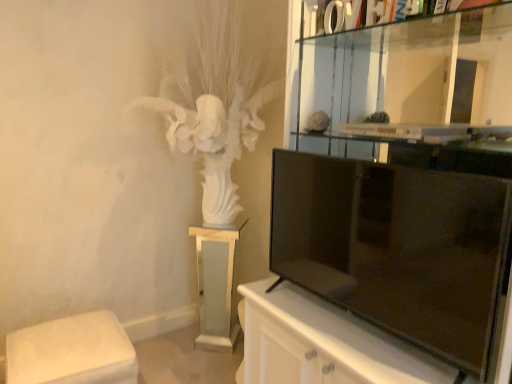
Locate an element on the screen. white fabric ottoman at lower left, which is the first furniture in left-to-right order is located at coordinates tap(72, 352).

The image size is (512, 384). What do you see at coordinates (217, 286) in the screenshot? I see `white frosted glass pedestal at center, which is counted as the 2th furniture, starting from the front` at bounding box center [217, 286].

Identify the location of white fabric ottoman at lower left, arranged as the second furniture when viewed from the back. (72, 352).

Is there a large distance between white fabric ottoman at lower left, arranged as the second furniture when viewed from the back, and white frosted glass pedestal at center, which is the 1th furniture from back to front?

No, there isn't a large distance between white fabric ottoman at lower left, arranged as the second furniture when viewed from the back, and white frosted glass pedestal at center, which is the 1th furniture from back to front.

From a real-world perspective, between white fabric ottoman at lower left, the 1th furniture positioned from the front, and white frosted glass pedestal at center, the 1th furniture positioned from the right, who is vertically lower?

From a 3D spatial view, white fabric ottoman at lower left, the 1th furniture positioned from the front, is below.

Which of these two, white fabric ottoman at lower left, the 2th furniture when ordered from right to left, or white frosted glass pedestal at center, the 1th furniture positioned from the right, stands taller?

white frosted glass pedestal at center, the 1th furniture positioned from the right.

Does white frosted glass pedestal at center, which is counted as the 2th furniture, starting from the front, have a greater height compared to white fabric ottoman at lower left, the 2th furniture when ordered from right to left?

Correct, white frosted glass pedestal at center, which is counted as the 2th furniture, starting from the front, is much taller as white fabric ottoman at lower left, the 2th furniture when ordered from right to left.

Does white frosted glass pedestal at center, which is the 1th furniture from back to front, have a smaller size compared to white fabric ottoman at lower left, arranged as the second furniture when viewed from the back?

Indeed, white frosted glass pedestal at center, which is the 1th furniture from back to front, has a smaller size compared to white fabric ottoman at lower left, arranged as the second furniture when viewed from the back.

Do you think white frosted glass pedestal at center, which is the 1th furniture from back to front, is within white fabric ottoman at lower left, the 2th furniture when ordered from right to left, or outside of it?

white frosted glass pedestal at center, which is the 1th furniture from back to front, is located beyond the bounds of white fabric ottoman at lower left, the 2th furniture when ordered from right to left.

From the picture: Are white frosted glass pedestal at center, which is the 2th furniture in left-to-right order, and white fabric ottoman at lower left, the 1th furniture positioned from the front, making contact?

No, white frosted glass pedestal at center, which is the 2th furniture in left-to-right order, is not touching white fabric ottoman at lower left, the 1th furniture positioned from the front.

Is white fabric ottoman at lower left, which is the first furniture in left-to-right order, behind black glossy tv at right?

Yes, it is behind black glossy tv at right.

Which is more to the right, white fabric ottoman at lower left, the 1th furniture positioned from the front, or black glossy tv at right?

black glossy tv at right is more to the right.

Does black glossy tv at right have a greater height compared to white fabric ottoman at lower left, which is the first furniture in left-to-right order?

Indeed, black glossy tv at right has a greater height compared to white fabric ottoman at lower left, which is the first furniture in left-to-right order.

Considering the relative sizes of black glossy tv at right and white fabric ottoman at lower left, the 2th furniture when ordered from right to left, in the image provided, is black glossy tv at right wider than white fabric ottoman at lower left, the 2th furniture when ordered from right to left,?

Incorrect, the width of black glossy tv at right does not surpass that of white fabric ottoman at lower left, the 2th furniture when ordered from right to left.

Is point (399, 215) positioned in front of point (92, 366)?

Yes, it is in front of point (92, 366).

From a real-world perspective, does black glossy tv at right stand above white frosted glass pedestal at center, which is counted as the 2th furniture, starting from the front?

Yes, from a real-world perspective, black glossy tv at right is above white frosted glass pedestal at center, which is counted as the 2th furniture, starting from the front.

Is black glossy tv at right facing towards white frosted glass pedestal at center, the 1th furniture positioned from the right?

No, black glossy tv at right does not turn towards white frosted glass pedestal at center, the 1th furniture positioned from the right.

From the image's perspective, does black glossy tv at right appear lower than white frosted glass pedestal at center, which is counted as the 2th furniture, starting from the front?

No, from the image's perspective, black glossy tv at right is not below white frosted glass pedestal at center, which is counted as the 2th furniture, starting from the front.

Could you tell me if white frosted glass pedestal at center, the 1th furniture positioned from the right, is facing black glossy tv at right?

No, white frosted glass pedestal at center, the 1th furniture positioned from the right, is not facing towards black glossy tv at right.

Is white frosted glass pedestal at center, which is the 2th furniture in left-to-right order, taller or shorter than black glossy tv at right?

white frosted glass pedestal at center, which is the 2th furniture in left-to-right order, is taller than black glossy tv at right.

Does white frosted glass pedestal at center, which is the 1th furniture from back to front, touch black glossy tv at right?

No.

From a real-world perspective, who is located higher, white frosted glass pedestal at center, which is counted as the 2th furniture, starting from the front, or black glossy tv at right?

black glossy tv at right, from a real-world perspective.

Identify the location of furniture above the white fabric ottoman at lower left, the 2th furniture when ordered from right to left (from the image's perspective). (217, 286).

Find the location of a particular element. furniture located in front of the white frosted glass pedestal at center, which is the 1th furniture from back to front is located at coordinates (72, 352).

Which object lies nearer to the anchor point white fabric ottoman at lower left, which is the first furniture in left-to-right order, white frosted glass pedestal at center, which is counted as the 2th furniture, starting from the front, or black glossy tv at right?

white frosted glass pedestal at center, which is counted as the 2th furniture, starting from the front.

From the image, which object appears to be nearer to white frosted glass pedestal at center, which is the 2th furniture in left-to-right order, white fabric ottoman at lower left, arranged as the second furniture when viewed from the back, or black glossy tv at right?

white fabric ottoman at lower left, arranged as the second furniture when viewed from the back.

Estimate the real-world distances between objects in this image. Which object is further from black glossy tv at right, white frosted glass pedestal at center, which is counted as the 2th furniture, starting from the front, or white fabric ottoman at lower left, which is the first furniture in left-to-right order?

Based on the image, white fabric ottoman at lower left, which is the first furniture in left-to-right order, appears to be further to black glossy tv at right.

Considering their positions, is black glossy tv at right positioned closer to white frosted glass pedestal at center, which is the 1th furniture from back to front, than white fabric ottoman at lower left, which is the first furniture in left-to-right order?

white fabric ottoman at lower left, which is the first furniture in left-to-right order.

Considering their positions, is white fabric ottoman at lower left, the 2th furniture when ordered from right to left, positioned further to black glossy tv at right than white frosted glass pedestal at center, which is the 1th furniture from back to front?

The object further to black glossy tv at right is white fabric ottoman at lower left, the 2th furniture when ordered from right to left.

Estimate the real-world distances between objects in this image. Which object is closer to white fabric ottoman at lower left, arranged as the second furniture when viewed from the back, black glossy tv at right or white frosted glass pedestal at center, which is the 1th furniture from back to front?

white frosted glass pedestal at center, which is the 1th furniture from back to front, lies closer to white fabric ottoman at lower left, arranged as the second furniture when viewed from the back, than the other object.

This screenshot has height=384, width=512. Find the location of `furniture between black glossy tv at right and white frosted glass pedestal at center, which is the 2th furniture in left-to-right order, in the front-back direction`. furniture between black glossy tv at right and white frosted glass pedestal at center, which is the 2th furniture in left-to-right order, in the front-back direction is located at coordinates (72, 352).